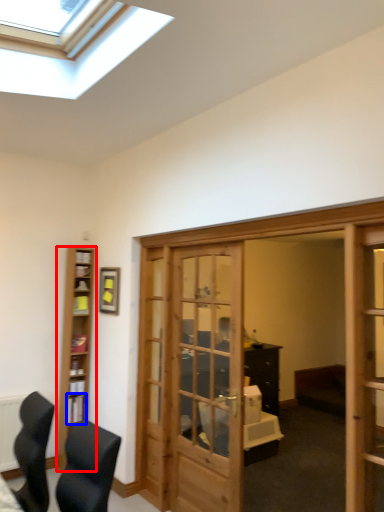
Question: Which point is closer to the camera, cabinetry (highlighted by a red box) or shelf (highlighted by a blue box)?

Choices:
 (A) cabinetry
 (B) shelf

Answer: (A)